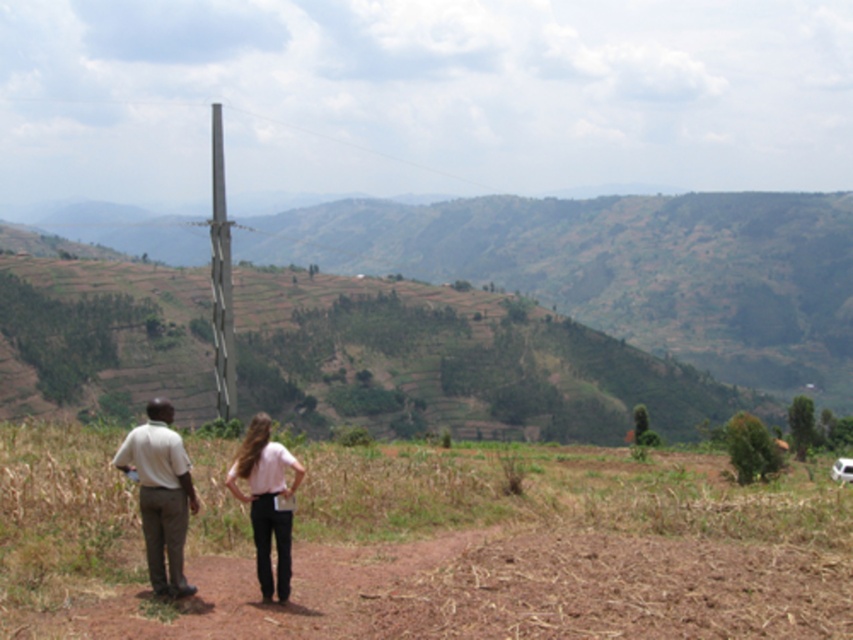
Does light pink fabric shirt at center have a smaller size compared to light brown cotton shirt at lower left?

Incorrect, light pink fabric shirt at center is not smaller in size than light brown cotton shirt at lower left.

Does light pink fabric shirt at center have a larger size compared to light brown cotton shirt at lower left?

Yes.

Based on the photo, who is more distant from viewer, (160, 432) or (138, 499)?

Point (138, 499)

You are a GUI agent. You are given a task and a screenshot of the screen. Output one action in this format:
    pyautogui.click(x=<x>, y=<y>)
    Task: Click on the light pink fabric shirt at center
    This screenshot has width=853, height=640.
    Given the screenshot: What is the action you would take?
    pyautogui.click(x=160, y=493)

Is light brown cotton shirt at lower left bigger than pink fabric pants at center?

Actually, light brown cotton shirt at lower left might be smaller than pink fabric pants at center.

Is light brown cotton shirt at lower left to the right of pink fabric pants at center from the viewer's perspective?

In fact, light brown cotton shirt at lower left is to the left of pink fabric pants at center.

Is point (141, 518) less distant than point (260, 436)?

No, (141, 518) is further to viewer.

I want to click on light brown cotton shirt at lower left, so click(161, 493).

Image resolution: width=853 pixels, height=640 pixels. Find the location of `light pink fabric shirt at center`. light pink fabric shirt at center is located at coordinates (160, 493).

Is light pink fabric shirt at center closer to the viewer compared to pink fabric pants at center?

Yes, it is in front of pink fabric pants at center.

You are a GUI agent. You are given a task and a screenshot of the screen. Output one action in this format:
    pyautogui.click(x=<x>, y=<y>)
    Task: Click on the light pink fabric shirt at center
    The width and height of the screenshot is (853, 640).
    Given the screenshot: What is the action you would take?
    pyautogui.click(x=160, y=493)